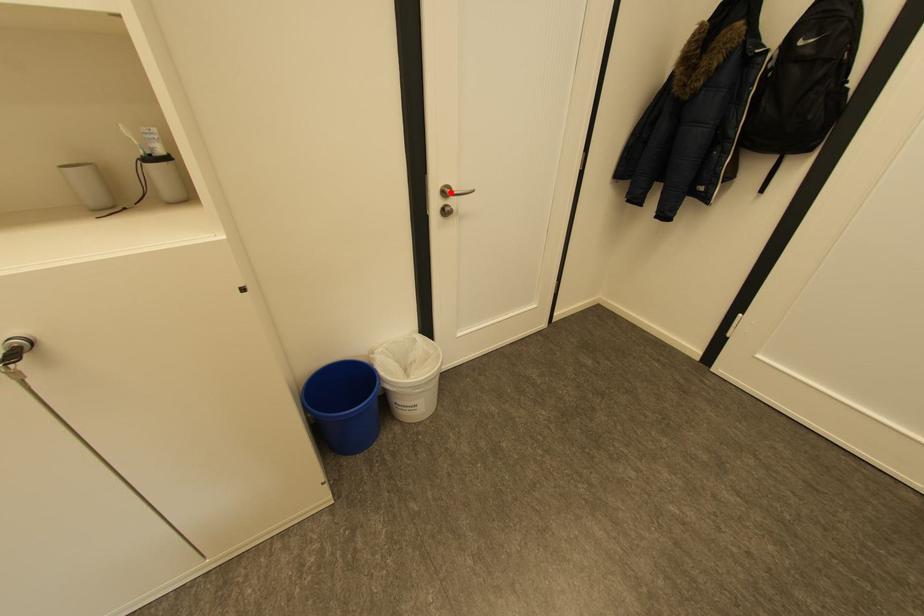
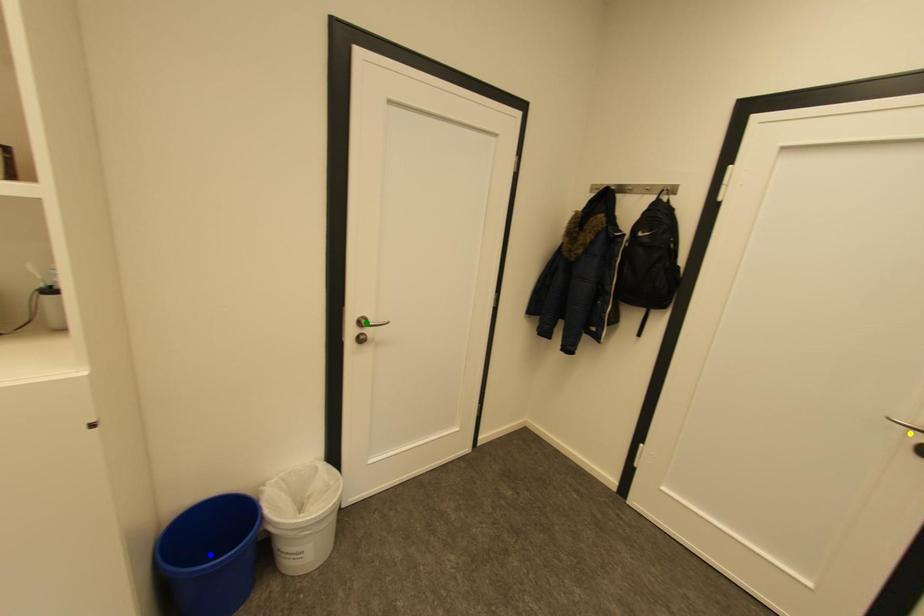
Question: I am providing you with two images of the same scene from different viewpoints. A red point is marked on the first image. You are given multiple points on the second image. Can you choose the point in image 2 that corresponds to the point in image 1?

Choices:
 (A) yellow point
 (B) blue point
 (C) green point

Answer: (C)